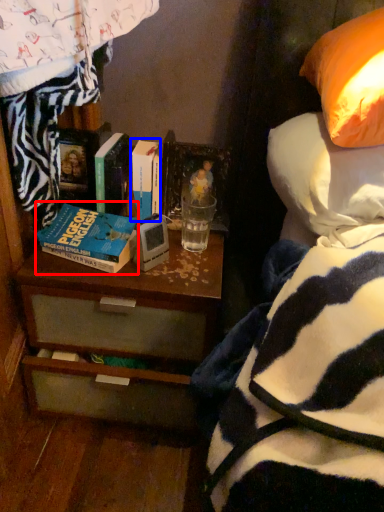
Question: Which of the following is the farthest to the observer, book (highlighted by a red box) or book (highlighted by a blue box)?

Choices:
 (A) book
 (B) book

Answer: (B)